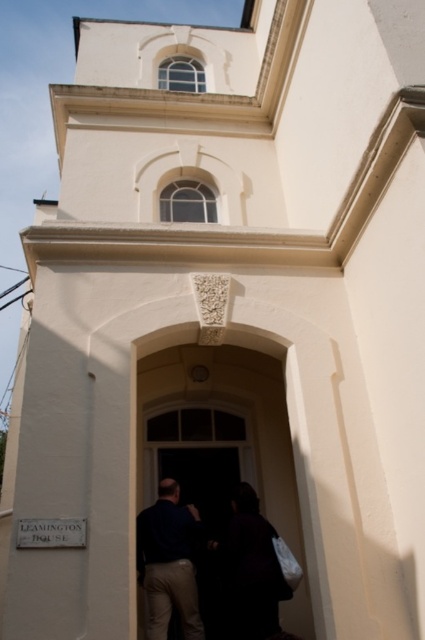
Is dark brown wooden door at center below dark fabric couple at center?

No.

Which is in front, point (178, 365) or point (142, 554)?

Point (142, 554)

Does point (153, 438) come closer to viewer compared to point (272, 525)?

No, (153, 438) is further to viewer.

Find the location of `dark brown wooden door at center`. dark brown wooden door at center is located at coordinates (221, 442).

Which is more to the right, dark brown wooden door at center or dark blue shirt at center?

dark brown wooden door at center

In the scene shown: Can you confirm if dark brown wooden door at center is positioned to the left of dark blue shirt at center?

In fact, dark brown wooden door at center is to the right of dark blue shirt at center.

Who is more forward, (141, 362) or (141, 525)?

Point (141, 525) is in front.

This screenshot has height=640, width=425. I want to click on dark brown wooden door at center, so click(x=221, y=442).

This screenshot has height=640, width=425. What do you see at coordinates (252, 568) in the screenshot? I see `dark fabric couple at center` at bounding box center [252, 568].

Can you confirm if dark fabric couple at center is positioned to the left of dark blue shirt at center?

Incorrect, dark fabric couple at center is not on the left side of dark blue shirt at center.

Measure the distance between point [274,531] and camera.

Answer: Point [274,531] and camera are 48.18 feet apart from each other.

Locate an element on the screen. The height and width of the screenshot is (640, 425). dark fabric couple at center is located at coordinates (252, 568).